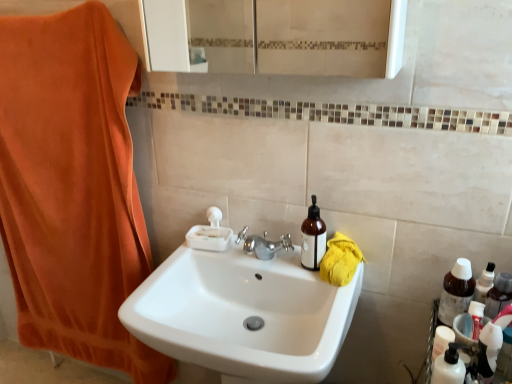
Question: From their relative heights in the image, would you say translucent plastic bottle at lower right is taller or shorter than translucent plastic toothpaste tube at lower right?

Choices:
 (A) tall
 (B) short

Answer: (B)

Question: Is point (458, 375) closer or farther from the camera than point (481, 362)?

Choices:
 (A) closer
 (B) farther

Answer: (A)

Question: Considering the real-world distances, which object is closest to the white glossy sink at center?

Choices:
 (A) brown glass bottle at right, placed as the 2th bottle when sorted from left to right
 (B) brown glass bottle at upper right, placed as the second bottle when sorted from right to left
 (C) translucent plastic bottle at lower right
 (D) orange cotton towel at left
 (E) yellow cotton towel at right

Answer: (B)

Question: Based on their relative distances, which object is nearer to the brown glass bottle at right, acting as the 1th bottle starting from the right?

Choices:
 (A) brown glass bottle at upper right, placed as the second bottle when sorted from right to left
 (B) translucent plastic bottle at lower right
 (C) orange cotton towel at left
 (D) white glossy sink at center
 (E) translucent plastic toothpaste tube at lower right

Answer: (E)